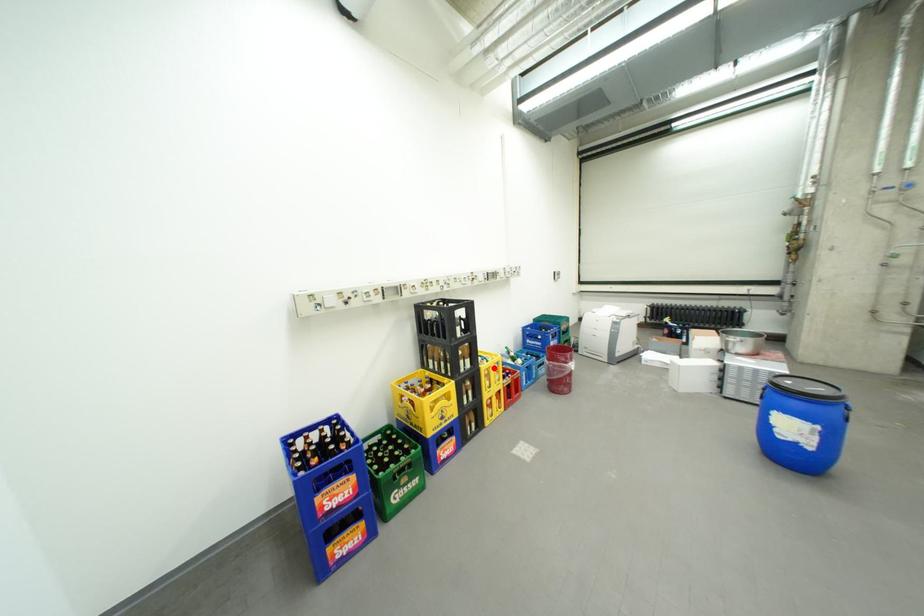
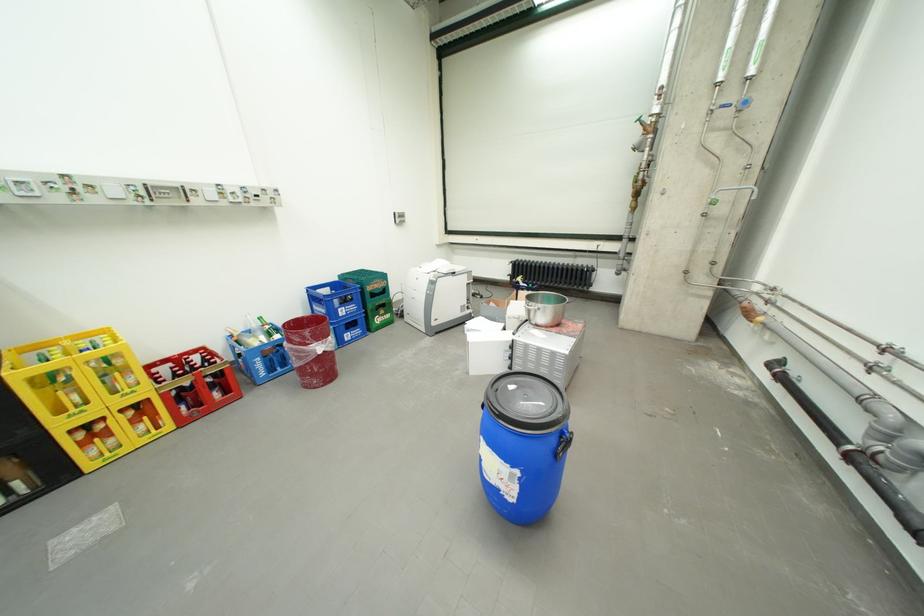
Question: I am providing you with two images of the same scene from different viewpoints. A red point is marked on the first image. Can you still see the location of the red point in image 2?

Choices:
 (A) Yes
 (B) No

Answer: (A)